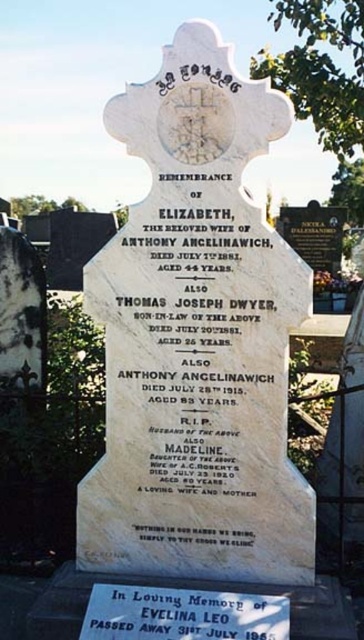
Consider the image. Is white marble gravestone at center to the left of white marble plaque at lower center from the viewer's perspective?

Indeed, white marble gravestone at center is positioned on the left side of white marble plaque at lower center.

Between white marble gravestone at center and white marble plaque at lower center, which one has more height?

white marble gravestone at center is taller.

Locate an element on the screen. The image size is (364, 640). white marble gravestone at center is located at coordinates (196, 339).